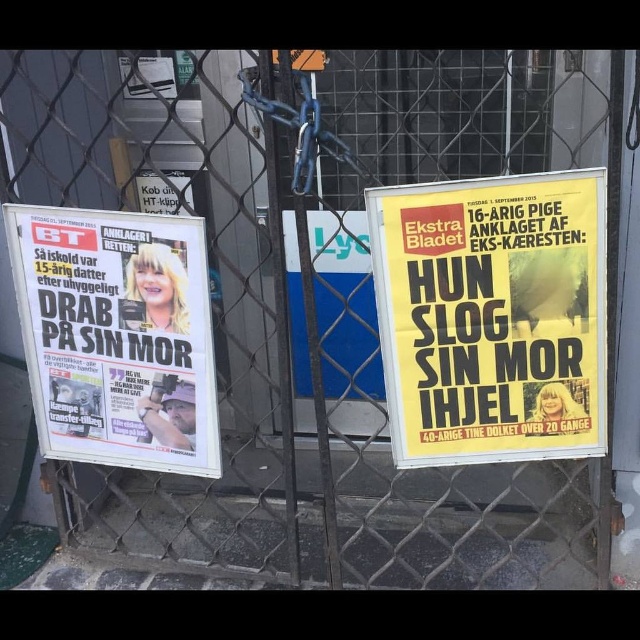
Does yellow paper poster at right come behind white glossy poster at left?

That is False.

Identify the location of yellow paper poster at right. The image size is (640, 640). (492, 316).

You are a GUI agent. You are given a task and a screenshot of the screen. Output one action in this format:
    pyautogui.click(x=<x>, y=<y>)
    Task: Click on the yellow paper poster at right
    
    Given the screenshot: What is the action you would take?
    pyautogui.click(x=492, y=316)

Where is `yellow paper poster at right`? This screenshot has width=640, height=640. yellow paper poster at right is located at coordinates (492, 316).